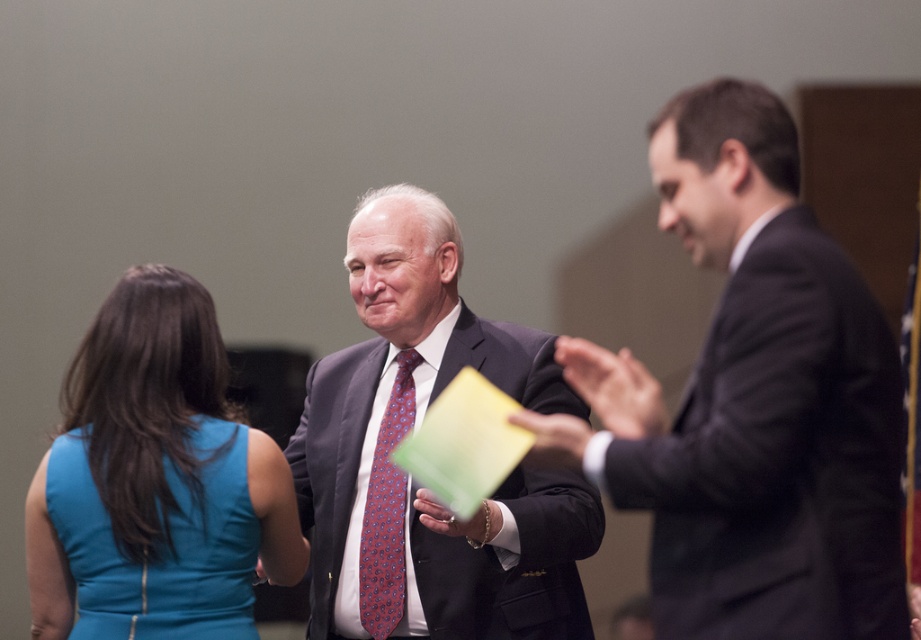
Question: Can you confirm if dark gray suit at right is positioned below red paisley silk tie at center?

Choices:
 (A) yes
 (B) no

Answer: (B)

Question: Which point appears closest to the camera in this image?

Choices:
 (A) (177, 276)
 (B) (217, 497)
 (C) (393, 445)

Answer: (B)

Question: Does dark gray suit at right appear on the left side of blue satin dress at lower left?

Choices:
 (A) yes
 (B) no

Answer: (B)

Question: Considering the real-world distances, which object is farthest from the blue satin dress at lower left?

Choices:
 (A) red paisley silk tie at center
 (B) teal satin dress at lower left

Answer: (A)

Question: Which object is farther from the camera taking this photo?

Choices:
 (A) dark gray suit at right
 (B) teal satin dress at lower left

Answer: (B)

Question: Is matte gray suit at center bigger than blue satin dress at lower left?

Choices:
 (A) no
 (B) yes

Answer: (B)